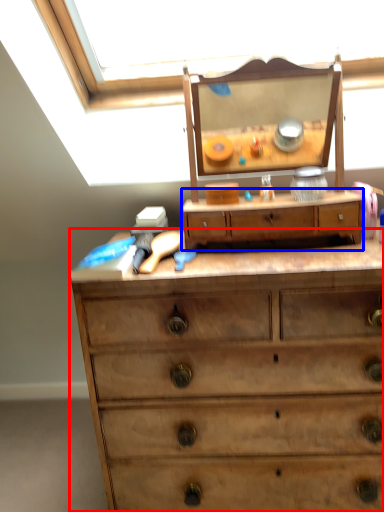
Question: Which point is closer to the camera, chest of drawers (highlighted by a red box) or drawer (highlighted by a blue box)?

Choices:
 (A) chest of drawers
 (B) drawer

Answer: (A)